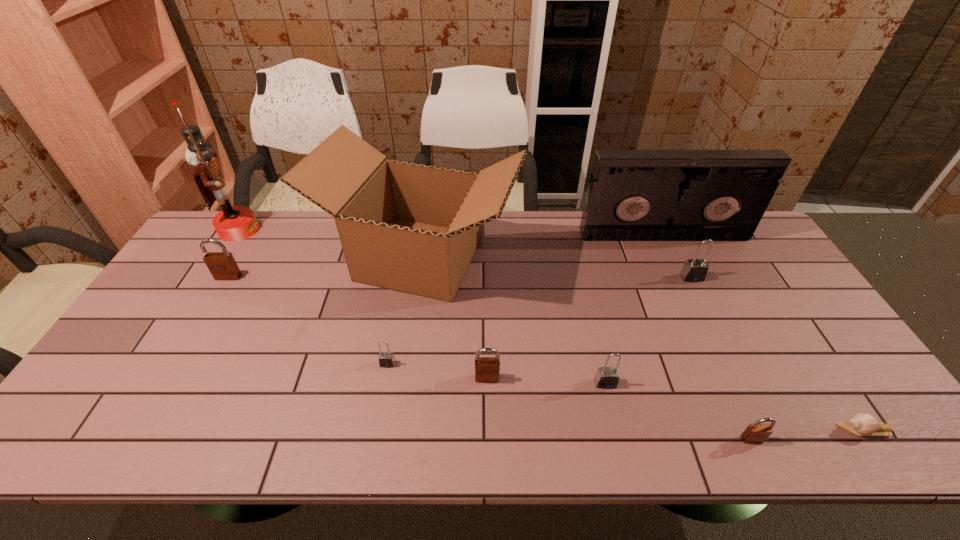
I want to click on the tallest object, so click(x=233, y=223).

Where is `red nutcracker`? red nutcracker is located at coordinates click(233, 223).

This screenshot has height=540, width=960. I want to click on box, so click(413, 228).

Find the location of a particular element. The width and height of the screenshot is (960, 540). black videotape is located at coordinates (633, 195).

At what (x,y) coordinates should I click in order to perform the action: click on the farthest gray padlock. Please return your answer as a coordinate pair (x, y). The width and height of the screenshot is (960, 540). Looking at the image, I should click on (694, 270).

Locate an element on the screen. the rightmost gray padlock is located at coordinates (694, 270).

The height and width of the screenshot is (540, 960). I want to click on the biggest brown padlock, so pos(222,265).

The image size is (960, 540). In order to click on the leftmost brown padlock in this screenshot , I will do [222, 265].

This screenshot has width=960, height=540. What are the coordinates of `the third padlock from right to left` in the screenshot? It's located at (606, 377).

The image size is (960, 540). Find the location of `the sixth object from left to right`. the sixth object from left to right is located at coordinates (606, 377).